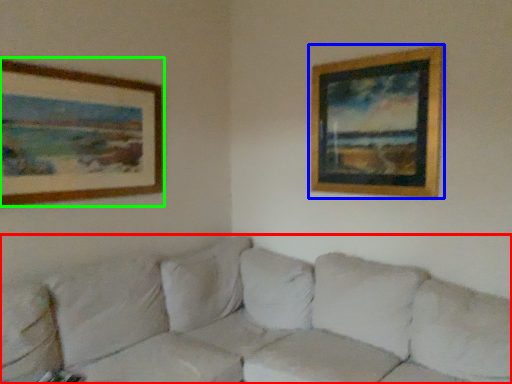
Question: Based on their relative distances, which object is nearer to studio couch (highlighted by a red box)? Choose from picture frame (highlighted by a blue box) and picture frame (highlighted by a green box).

Choices:
 (A) picture frame
 (B) picture frame

Answer: (B)